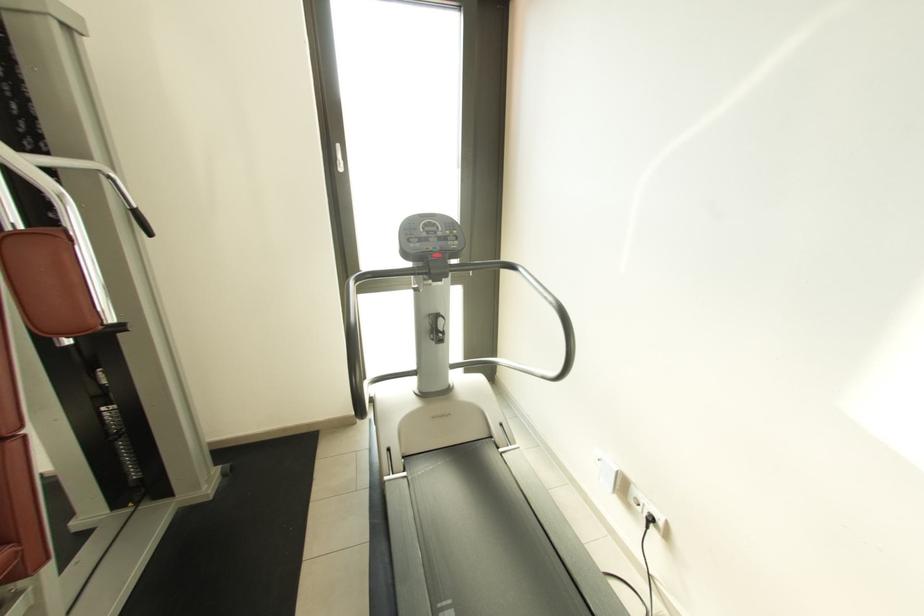
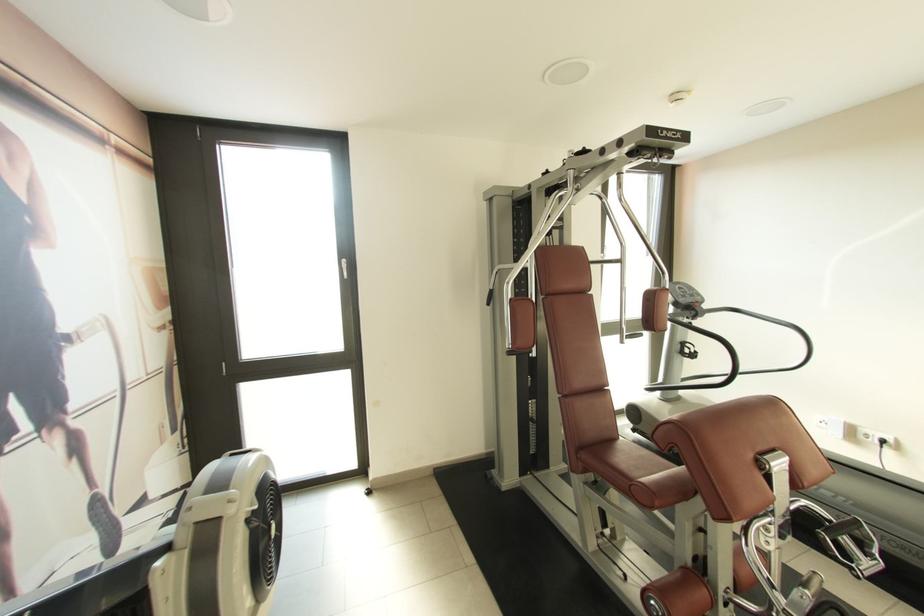
The point at (640, 493) is marked in the first image. Where is the corresponding point in the second image?

(868, 432)